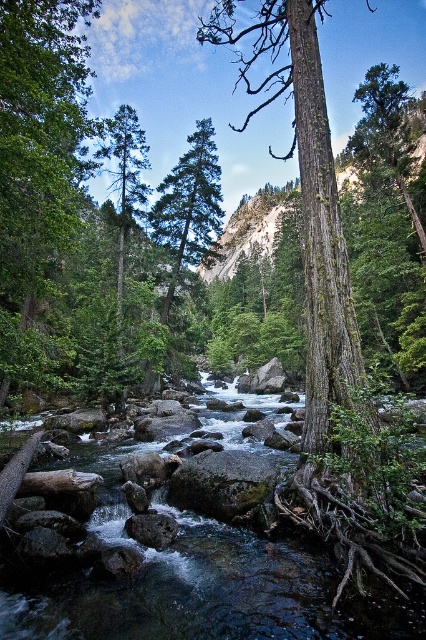
You are standing at the camera position observing the serene natural scene. There is a specific point marked at coordinates point (x=301, y=173). Can you determine if this point is within a safe distance for you to reach without entering the river?

The point point (x=301, y=173) is 7.18 meters away from the camera, so it is within a safe distance to reach without entering the river.

Consider the image. You are standing at the edge of the river in the scene and notice a specific location marked by the coordinates point (307, 198). What object is located at that point?

The point (307, 198) corresponds to the green mossy tree at center.